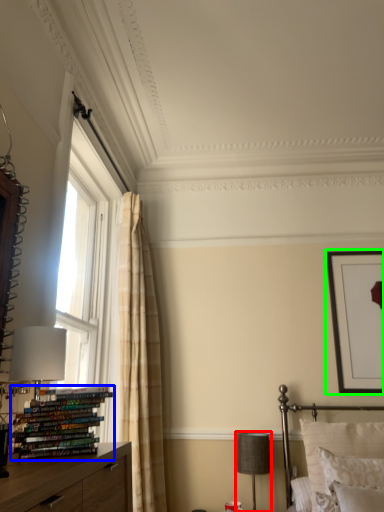
Question: Which is farther away from table lamp (highlighted by a red box)? book (highlighted by a blue box) or picture frame (highlighted by a green box)?

Choices:
 (A) book
 (B) picture frame

Answer: (A)